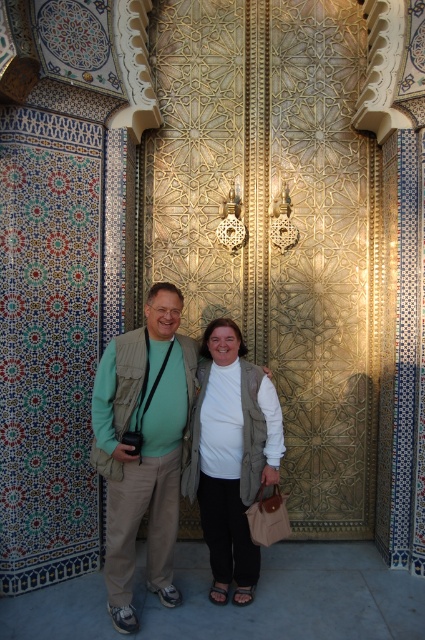
Question: Is green fabric vest at center positioned at the back of white cotton shirt at center?

Choices:
 (A) yes
 (B) no

Answer: (B)

Question: Among these points, which one is farthest from the camera?

Choices:
 (A) (223, 515)
 (B) (147, 492)

Answer: (A)

Question: Among these objects, which one is nearest to the camera?

Choices:
 (A) white cotton shirt at center
 (B) green fabric vest at center

Answer: (B)

Question: Can you confirm if green fabric vest at center is bigger than white cotton shirt at center?

Choices:
 (A) no
 (B) yes

Answer: (B)

Question: Is green fabric vest at center positioned behind white cotton shirt at center?

Choices:
 (A) no
 (B) yes

Answer: (A)